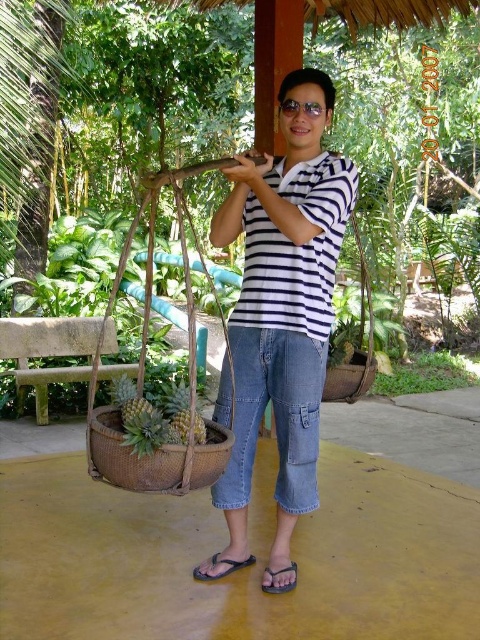
Question: Is brown woven basket at lower right above brown leather sandal at lower center?

Choices:
 (A) no
 (B) yes

Answer: (B)

Question: Which point is farther from the camera taking this photo?

Choices:
 (A) (273, 257)
 (B) (418, 372)

Answer: (B)

Question: Is white striped shirt at center positioned before woven brown basket at lower center?

Choices:
 (A) no
 (B) yes

Answer: (A)

Question: Is woven brown basket at lower center thinner than brown woven basket at lower right?

Choices:
 (A) no
 (B) yes

Answer: (A)

Question: Which point appears farthest from the camera in this image?

Choices:
 (A) (360, 362)
 (B) (474, 376)
 (C) (206, 577)
 (D) (133, 452)

Answer: (B)

Question: Based on their relative distances, which object is farther from the woven brown basket at lower center?

Choices:
 (A) green leafy plant at lower right
 (B) white striped shirt at center
 (C) brown woven basket at lower right

Answer: (A)